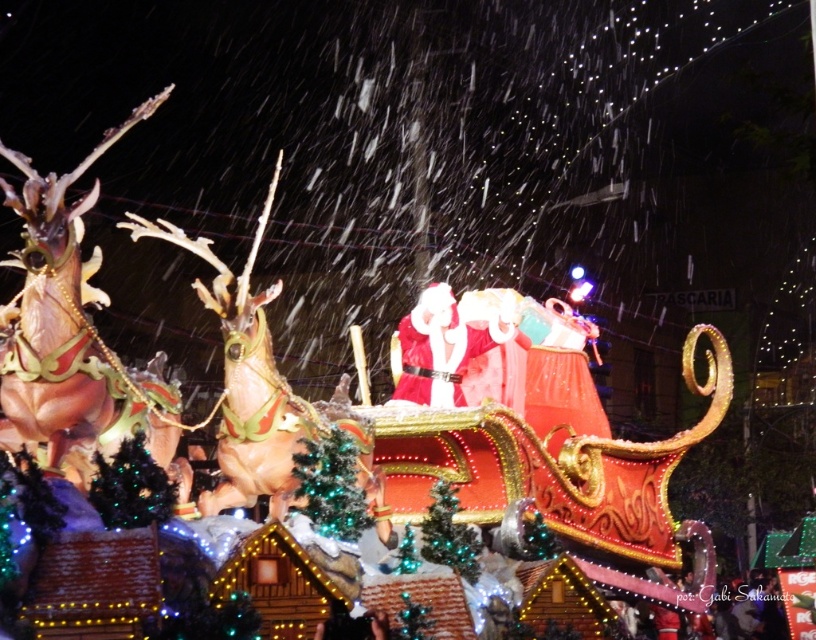
Question: From the image, what is the correct spatial relationship of green glittering christmas tree at center in relation to green beaded garland at center?

Choices:
 (A) above
 (B) below

Answer: (A)

Question: Which object is the farthest from the velvet red santa at center?

Choices:
 (A) green glittering christmas tree at center
 (B) shiny gold antlers at left
 (C) shiny gold reindeer at upper left
 (D) green beaded garland at center

Answer: (B)

Question: Which point is farther to the camera?

Choices:
 (A) shiny gold antlers at left
 (B) shiny gold reindeer at upper left

Answer: (B)

Question: Observing the image, what is the correct spatial positioning of velvet red santa at center in reference to green glittering christmas tree at center?

Choices:
 (A) left
 (B) right

Answer: (B)

Question: Which point is farther from the camera taking this photo?

Choices:
 (A) (38, 209)
 (B) (482, 348)

Answer: (B)

Question: Does shiny gold reindeer at upper left appear on the left side of green glittering christmas tree at center?

Choices:
 (A) no
 (B) yes

Answer: (B)